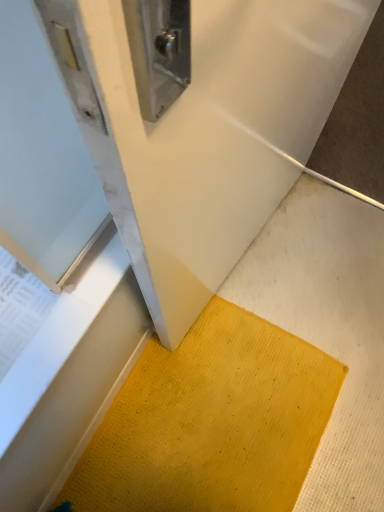
Question: Should I look upward or downward to see yellow textured mat at lower center?

Choices:
 (A) up
 (B) down

Answer: (B)

Question: Should I look upward or downward to see yellow textured mat at lower center?

Choices:
 (A) down
 (B) up

Answer: (B)

Question: Is yellow textured mat at lower center positioned behind yellow textured mat at lower center?

Choices:
 (A) yes
 (B) no

Answer: (A)

Question: Is yellow textured mat at lower center located outside yellow textured mat at lower center?

Choices:
 (A) no
 (B) yes

Answer: (B)

Question: Is yellow textured mat at lower center shorter than yellow textured mat at lower center?

Choices:
 (A) no
 (B) yes

Answer: (B)

Question: Considering the relative sizes of yellow textured mat at lower center and yellow textured mat at lower center in the image provided, is yellow textured mat at lower center bigger than yellow textured mat at lower center?

Choices:
 (A) no
 (B) yes

Answer: (A)

Question: Is yellow textured mat at lower center touching yellow textured mat at lower center?

Choices:
 (A) yes
 (B) no

Answer: (B)

Question: Is yellow textured mat at lower center oriented towards yellow textured mat at lower center?

Choices:
 (A) no
 (B) yes

Answer: (A)

Question: From a real-world perspective, is yellow textured mat at lower center beneath yellow textured mat at lower center?

Choices:
 (A) yes
 (B) no

Answer: (B)

Question: Can you confirm if yellow textured mat at lower center is positioned to the right of yellow textured mat at lower center?

Choices:
 (A) no
 (B) yes

Answer: (B)

Question: Is yellow textured mat at lower center beside yellow textured mat at lower center?

Choices:
 (A) no
 (B) yes

Answer: (A)

Question: Considering the relative sizes of yellow textured mat at lower center and yellow textured mat at lower center in the image provided, is yellow textured mat at lower center bigger than yellow textured mat at lower center?

Choices:
 (A) no
 (B) yes

Answer: (B)

Question: Is yellow textured mat at lower center wider than yellow textured mat at lower center?

Choices:
 (A) yes
 (B) no

Answer: (B)

Question: From the image's perspective, is yellow textured mat at lower center on yellow textured mat at lower center?

Choices:
 (A) yes
 (B) no

Answer: (A)

Question: Considering the positions of yellow textured mat at lower center and yellow textured mat at lower center in the image, is yellow textured mat at lower center bigger or smaller than yellow textured mat at lower center?

Choices:
 (A) small
 (B) big

Answer: (A)